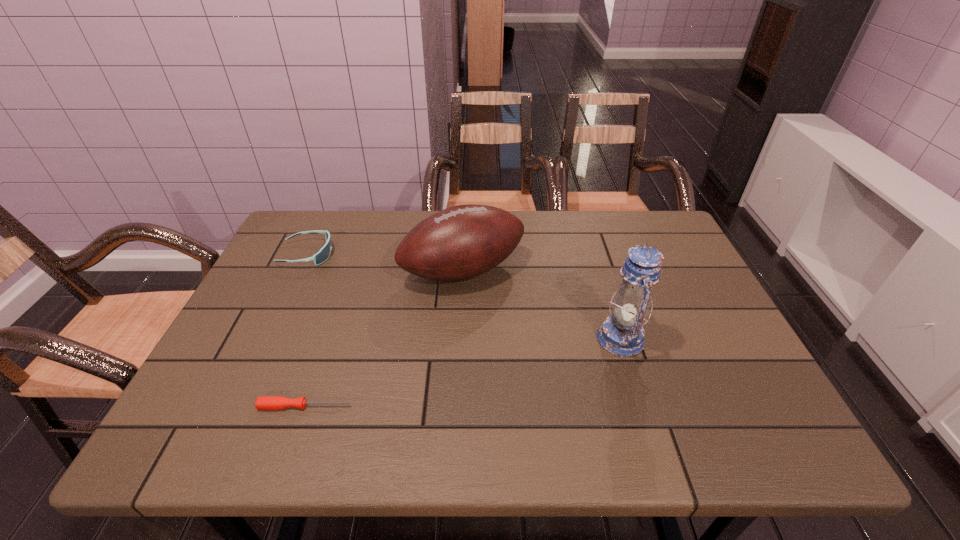
The height and width of the screenshot is (540, 960). In order to click on vacant space at the far edge of the desktop in this screenshot , I will do `click(585, 225)`.

The width and height of the screenshot is (960, 540). Find the location of `free space at the near edge of the desktop`. free space at the near edge of the desktop is located at coordinates (440, 437).

This screenshot has width=960, height=540. Identify the location of vacant space at the left edge. (256, 306).

Locate an element on the screen. The height and width of the screenshot is (540, 960). vacant space at the right edge of the desktop is located at coordinates (676, 287).

The height and width of the screenshot is (540, 960). I want to click on blank space at the near left corner of the desktop, so click(249, 416).

Identify the location of vacant space at the far right corner of the desktop. (650, 211).

The image size is (960, 540). I want to click on free space that is in between the second tallest object and the rightmost object, so coord(541,305).

Where is `unoccupied position between the tallest object and the football (American)`? unoccupied position between the tallest object and the football (American) is located at coordinates (541, 305).

The width and height of the screenshot is (960, 540). In order to click on free space between the rightmost object and the goggles in this screenshot , I will do `click(464, 296)`.

The height and width of the screenshot is (540, 960). Find the location of `free point between the shortest object and the rightmost object`. free point between the shortest object and the rightmost object is located at coordinates (463, 372).